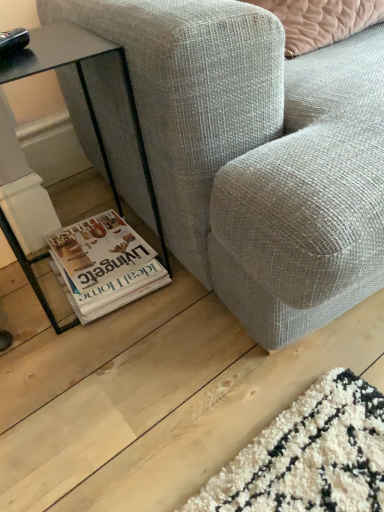
Question: Is black glass table at lower left next to textured gray fabric couch at lower center and touching it?

Choices:
 (A) yes
 (B) no

Answer: (B)

Question: From a real-world perspective, is black glass table at lower left on textured gray fabric couch at lower center?

Choices:
 (A) no
 (B) yes

Answer: (A)

Question: Does black glass table at lower left appear on the right side of textured gray fabric couch at lower center?

Choices:
 (A) yes
 (B) no

Answer: (B)

Question: From the image's perspective, is black glass table at lower left located above textured gray fabric couch at lower center?

Choices:
 (A) no
 (B) yes

Answer: (A)

Question: Is black glass table at lower left positioned far away from textured gray fabric couch at lower center?

Choices:
 (A) no
 (B) yes

Answer: (A)

Question: Considering the relative sizes of black glass table at lower left and textured gray fabric couch at lower center in the image provided, is black glass table at lower left thinner than textured gray fabric couch at lower center?

Choices:
 (A) yes
 (B) no

Answer: (A)

Question: Can you confirm if white glossy magazine at lower left is taller than textured gray fabric couch at lower center?

Choices:
 (A) yes
 (B) no

Answer: (B)

Question: Is white glossy magazine at lower left further to the viewer compared to textured gray fabric couch at lower center?

Choices:
 (A) yes
 (B) no

Answer: (A)

Question: Can you see white glossy magazine at lower left touching textured gray fabric couch at lower center?

Choices:
 (A) yes
 (B) no

Answer: (B)

Question: Is white glossy magazine at lower left far away from textured gray fabric couch at lower center?

Choices:
 (A) no
 (B) yes

Answer: (A)

Question: Is white glossy magazine at lower left oriented towards textured gray fabric couch at lower center?

Choices:
 (A) no
 (B) yes

Answer: (A)

Question: Is the depth of white glossy magazine at lower left less than that of textured gray fabric couch at lower center?

Choices:
 (A) yes
 (B) no

Answer: (B)

Question: Is textured gray fabric couch at lower center positioned far away from black glass table at lower left?

Choices:
 (A) no
 (B) yes

Answer: (A)